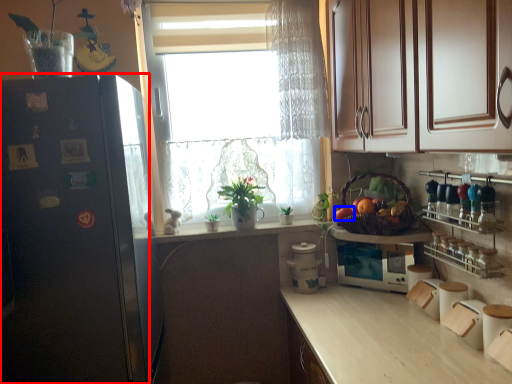
Question: Among these objects, which one is farthest to the camera, cupboard (highlighted by a red box) or fruit (highlighted by a blue box)?

Choices:
 (A) cupboard
 (B) fruit

Answer: (B)